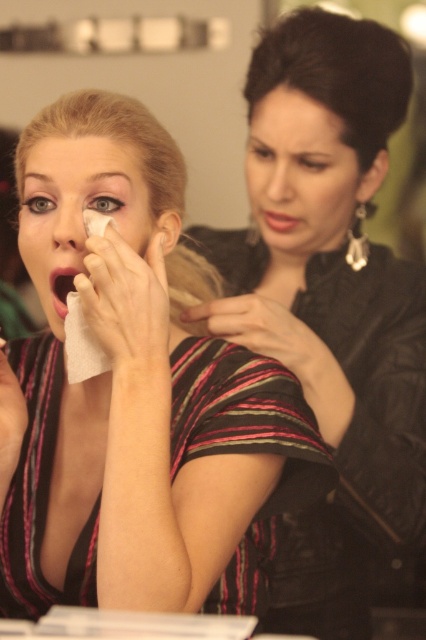
You are a photographer trying to capture a candid shot of the smooth skin face at center without the black leather jacket at upper right blocking the view. Is the jacket currently in a position that would obstruct your shot?

The black leather jacket at upper right is closer to the viewer than the smooth skin face at center, so it would obstruct the view of the smooth skin face at center.

You are a makeup artist observing the scene. You notice the matte black face at center and the matte red lipstick at center. Which object is closer to you?

The matte black face at center is closer to you because it is in front of the matte red lipstick at center.